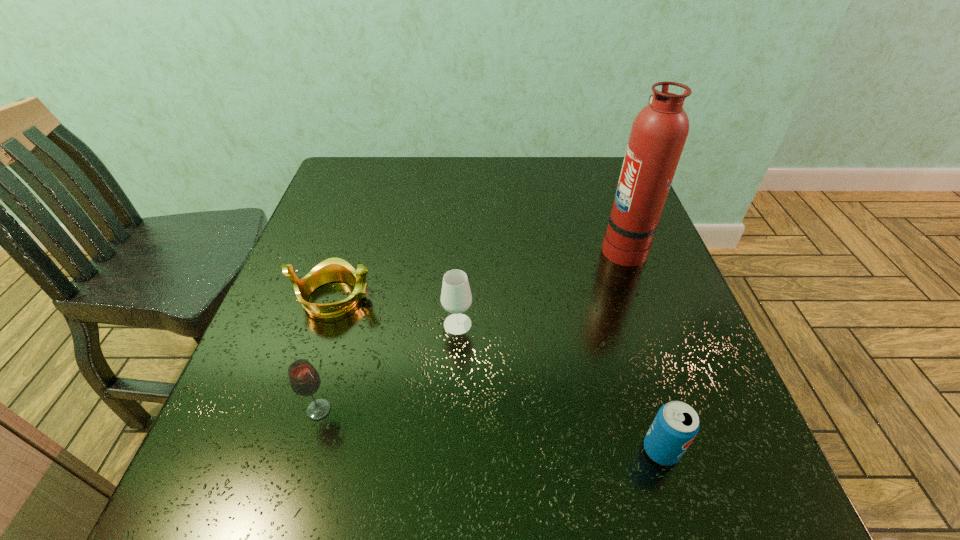
Identify the location of vacant area situated 0.170m on the label side of the tallest object. (531, 247).

Identify the location of free space located on the back of the third object from right to left. The image size is (960, 540). (460, 282).

Identify the location of vacant space located 0.210m on the right of the left glass drink container. This screenshot has height=540, width=960. (454, 410).

I want to click on vacant space located on the left of the soda can, so click(x=549, y=450).

The image size is (960, 540). In order to click on free space located at the front emblem of the tiara in this screenshot , I will do `click(444, 298)`.

The image size is (960, 540). Identify the location of object at the near edge. (676, 424).

Locate an element on the screen. glass drink container at the left edge is located at coordinates (304, 379).

Find the location of a particular element. Image resolution: width=960 pixels, height=540 pixels. tiara that is at the left edge is located at coordinates (333, 269).

You are a GUI agent. You are given a task and a screenshot of the screen. Output one action in this format:
    pyautogui.click(x=<x>, y=<y>)
    Task: Click on the fire extinguisher located at the right edge
    
    Given the screenshot: What is the action you would take?
    pyautogui.click(x=658, y=134)

Find the location of a particular element. This screenshot has height=540, width=960. soda can that is positioned at the right edge is located at coordinates [676, 424].